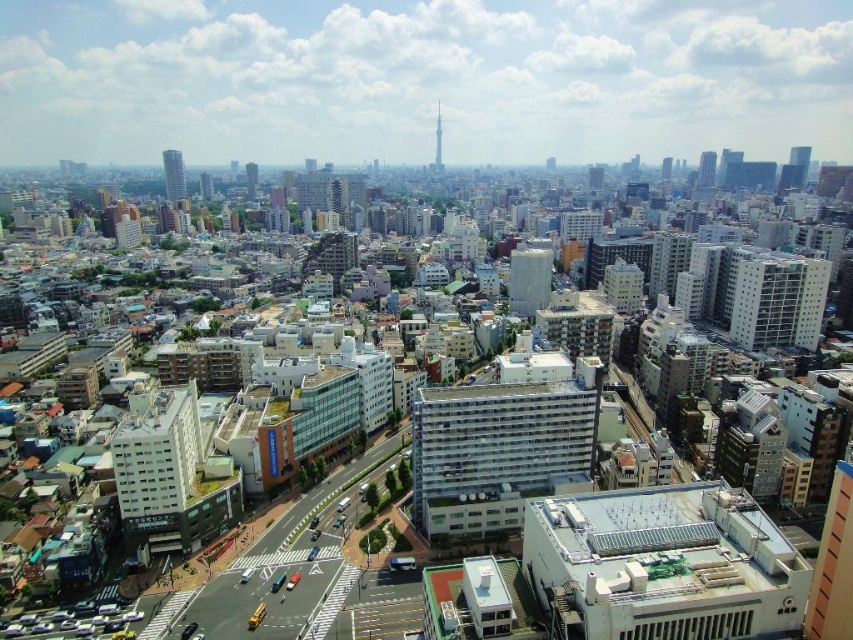
You are a drone operator trying to capture a photo of the white glass tower at center. There is a matte glass skyscraper at upper right in the way. Can you fly your drone around it to get a clear shot?

The matte glass skyscraper at upper right is closer to you than the white glass tower at center, so you can fly your drone around it to get a clear shot of the white glass tower at center.

You are a drone operator flying over the city. Your drone is currently above the white glass tower at center and the matte white building at center. Which building is closer to your drone?

The white glass tower at center is closer to the viewer than the matte white building at center, so the drone is closer to the white glass tower at center.

You are a city planner analyzing this urban layout. Given that the white glass tower at center is a proposed new building, and the matte glass skyscraper at upper right is an existing structure, which building would require a taller crane for construction? Please base your answer on their relative heights.

The white glass tower at center would require a taller crane for construction because it is taller than the matte glass skyscraper at upper right.